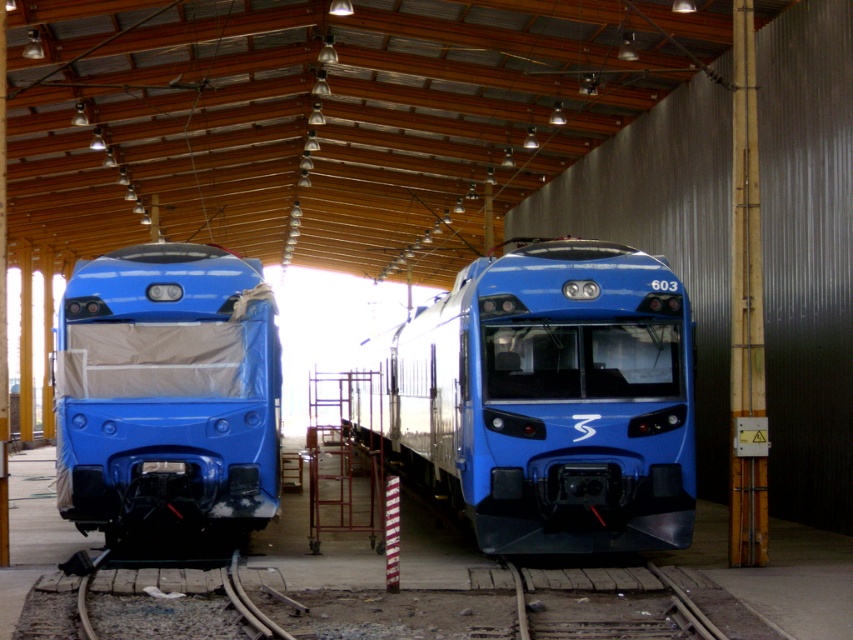
You are a maintenance worker standing at the point marked by the coordinate point at (633, 497). You need to walk to the nearest train. Which train should you go to?

The train on the left is closer to the point marked by the coordinate point at (633, 497) than the train on the right. Therefore, you should go to the train on the left.

Based on the coordinates provided, which train in the scene is located at point (550, 397)?

The point (550, 397) corresponds to the matte blue train at center.